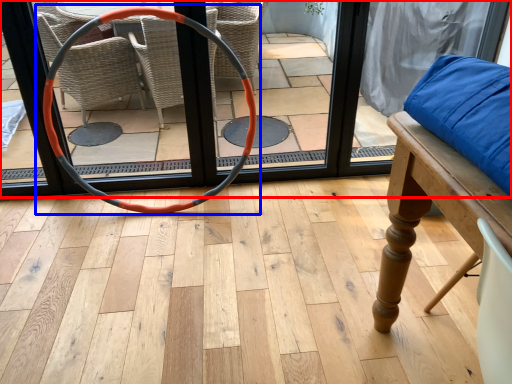
Question: Which object is closer to the camera taking this photo, screen door (highlighted by a red box) or hula hoop (highlighted by a blue box)?

Choices:
 (A) screen door
 (B) hula hoop

Answer: (B)